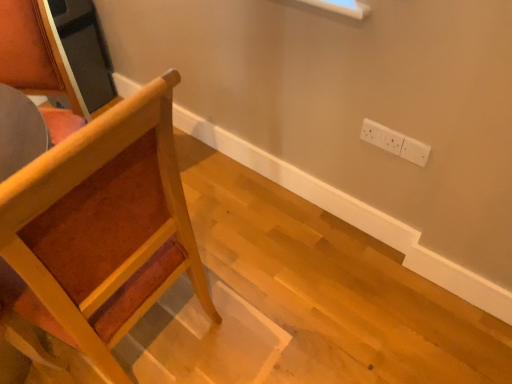
Question: In the image, is wooden chair at left positioned in front of or behind white plastic electric outlet at upper right?

Choices:
 (A) behind
 (B) front

Answer: (B)

Question: In terms of width, does wooden chair at left look wider or thinner when compared to white plastic electric outlet at upper right?

Choices:
 (A) wide
 (B) thin

Answer: (A)

Question: Based on their positions, is wooden chair at left located to the left or right of white plastic electric outlet at upper right?

Choices:
 (A) right
 (B) left

Answer: (B)

Question: Visually, is white plastic electric outlet at upper right positioned to the left or to the right of wooden chair at left?

Choices:
 (A) right
 (B) left

Answer: (A)

Question: Considering the positions of white plastic electric outlet at upper right and wooden chair at left in the image, is white plastic electric outlet at upper right wider or thinner than wooden chair at left?

Choices:
 (A) wide
 (B) thin

Answer: (B)

Question: Considering their positions, is white plastic electric outlet at upper right located in front of or behind wooden chair at left?

Choices:
 (A) behind
 (B) front

Answer: (A)

Question: Is white plastic electric outlet at upper right taller or shorter than wooden chair at left?

Choices:
 (A) tall
 (B) short

Answer: (B)